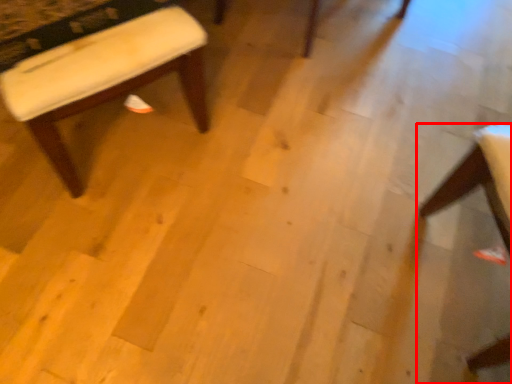
Question: From the image's perspective, what is the correct spatial relationship of chair (annotated by the red box) in relation to stool?

Choices:
 (A) below
 (B) above

Answer: (A)